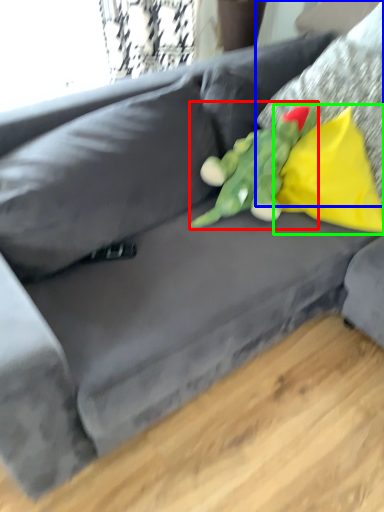
Question: Which is farther away from toy (highlighted by a red box)? pillow (highlighted by a blue box) or pillow (highlighted by a green box)?

Choices:
 (A) pillow
 (B) pillow

Answer: (A)